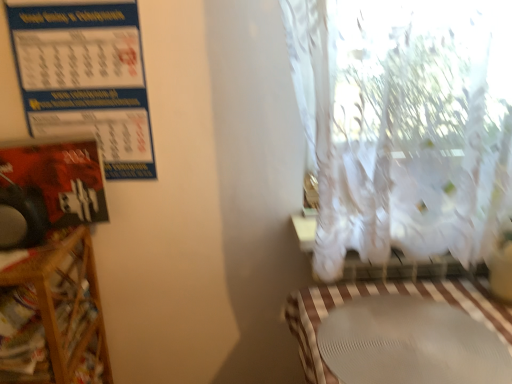
Question: Based on their sizes in the image, would you say wooden shelf at left is bigger or smaller than white matte table at lower right?

Choices:
 (A) big
 (B) small

Answer: (A)

Question: Visually, is wooden shelf at left positioned to the left or to the right of white matte table at lower right?

Choices:
 (A) right
 (B) left

Answer: (B)

Question: Considering the real-world distances, which object is closest to the wooden shelf at left?

Choices:
 (A) white matte table at lower right
 (B) blue paper calendar at upper left

Answer: (B)

Question: Considering the real-world distances, which object is closest to the blue paper calendar at upper left?

Choices:
 (A) white matte table at lower right
 (B) wooden shelf at left

Answer: (B)